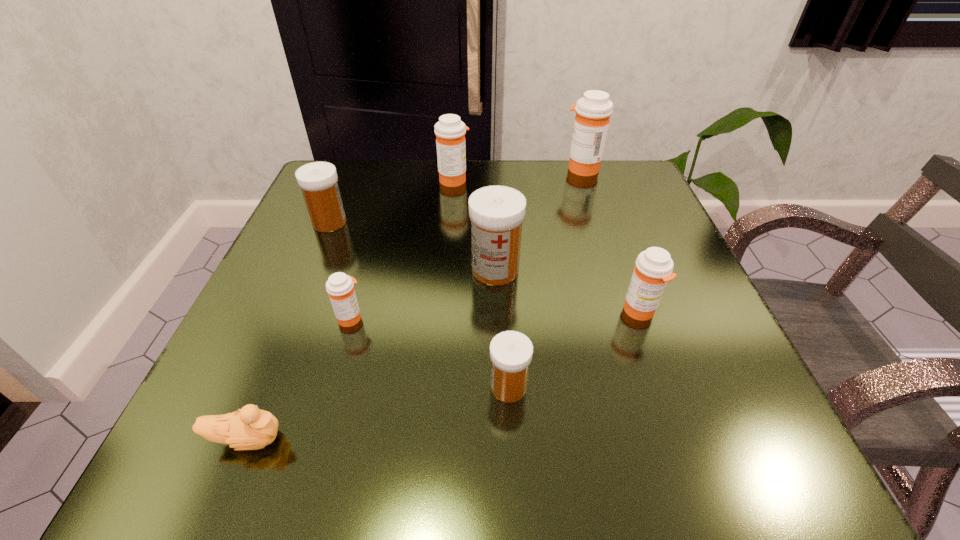
At what (x,y) coordinates should I click in order to perform the action: click on vacant area at the left edge of the desktop. Please return your answer as a coordinate pair (x, y). This screenshot has height=540, width=960. Looking at the image, I should click on (263, 324).

In the image, there is a desktop. In order to click on vacant space at the right edge in this screenshot , I will do `click(654, 333)`.

At what (x,y) coordinates should I click in order to perform the action: click on blank space at the far left corner. Please return your answer as a coordinate pair (x, y). This screenshot has width=960, height=540. Looking at the image, I should click on (349, 180).

You are a GUI agent. You are given a task and a screenshot of the screen. Output one action in this format:
    pyautogui.click(x=<x>, y=<y>)
    Task: Click on the free region at the near left corner
    This screenshot has width=960, height=540.
    Given the screenshot: What is the action you would take?
    pyautogui.click(x=248, y=465)

The height and width of the screenshot is (540, 960). Identify the location of free space at the far right corner of the desktop. (595, 195).

You are a GUI agent. You are given a task and a screenshot of the screen. Output one action in this format:
    pyautogui.click(x=<x>, y=<y>)
    Task: Click on the vacant area between the third orange medicine from right to left and the nearest medicine
    This screenshot has height=540, width=960.
    Given the screenshot: What is the action you would take?
    pyautogui.click(x=481, y=283)

The width and height of the screenshot is (960, 540). Find the location of `vacant area between the second smallest white medicine and the duckling`. vacant area between the second smallest white medicine and the duckling is located at coordinates (288, 331).

This screenshot has height=540, width=960. Identify the location of free space between the sixth object from right to left and the nearest medicine. (429, 352).

At what (x,y) coordinates should I click in order to perform the action: click on empty space between the biggest white medicine and the second nearest object. Please return your answer as a coordinate pair (x, y). This screenshot has height=540, width=960. Looking at the image, I should click on (502, 328).

Locate an element on the screen. The height and width of the screenshot is (540, 960). empty location between the second medicine from left to right and the shortest object is located at coordinates (299, 379).